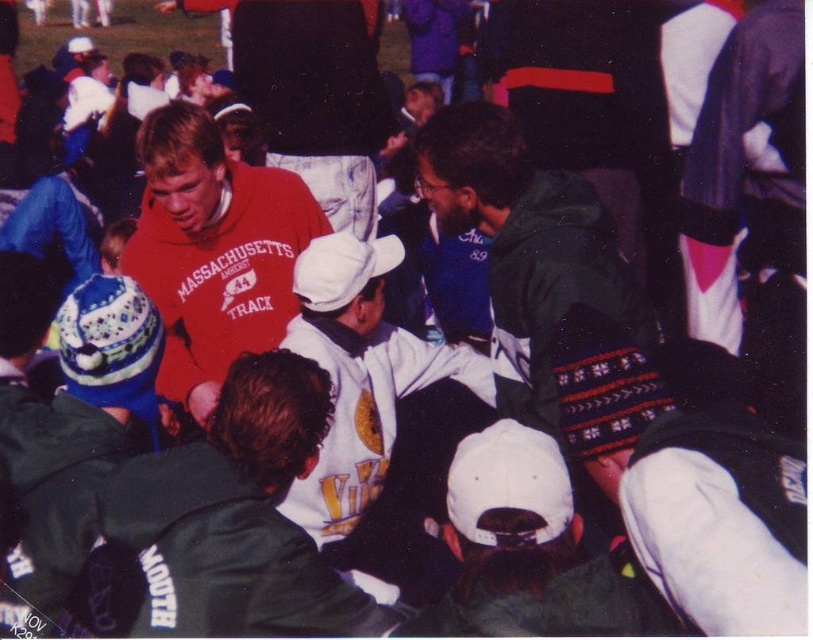
Question: Is the position of white fleece jacket at center less distant than that of matte red sweatshirt at center?

Choices:
 (A) yes
 (B) no

Answer: (A)

Question: Which object is closer to the camera taking this photo?

Choices:
 (A) matte red sweatshirt at center
 (B) knitted wool hat at center

Answer: (B)

Question: Is knitted wool hat at center bigger than matte red sweatshirt at center?

Choices:
 (A) no
 (B) yes

Answer: (A)

Question: Based on their relative distances, which object is nearer to the knitted wool hat at center?

Choices:
 (A) matte red sweatshirt at center
 (B) white fleece jacket at center

Answer: (B)

Question: Does white fleece jacket at center come in front of knitted wool hat at center?

Choices:
 (A) yes
 (B) no

Answer: (B)

Question: Among these objects, which one is farthest from the camera?

Choices:
 (A) white fleece jacket at center
 (B) matte red sweatshirt at center

Answer: (B)